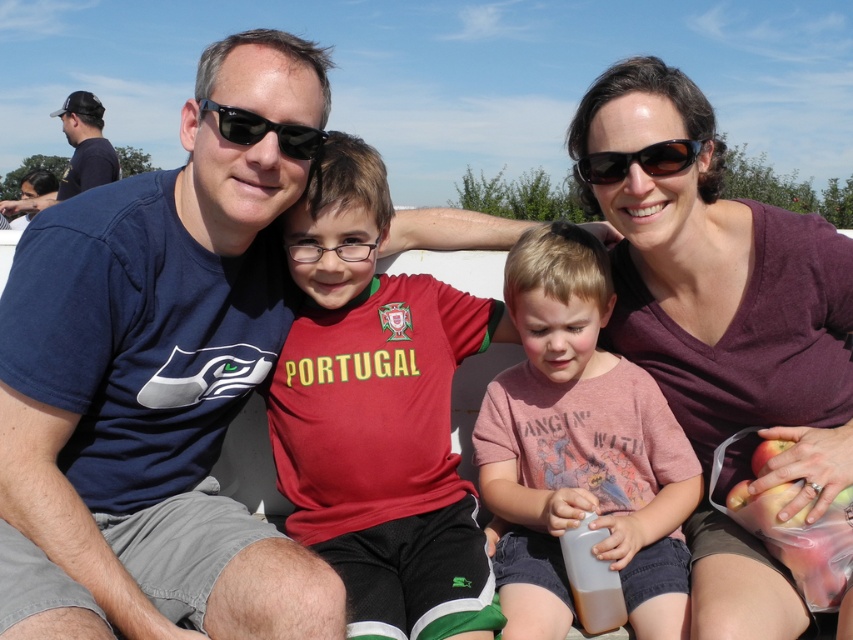
You are standing in front of the family photo. There are two points marked in the image. One is at coordinate point (x=729, y=604) and the other is at point (x=274, y=125). Which point is closer to you?

Point (x=729, y=604) is further to the viewer than point (x=274, y=125), so the point closer to you is point (x=274, y=125).

You are an observer looking at the scene. You notice the matte purple shirt at center and the black plastic sunglasses at center. Which object is taller?

The matte purple shirt at center is taller than the black plastic sunglasses at center.